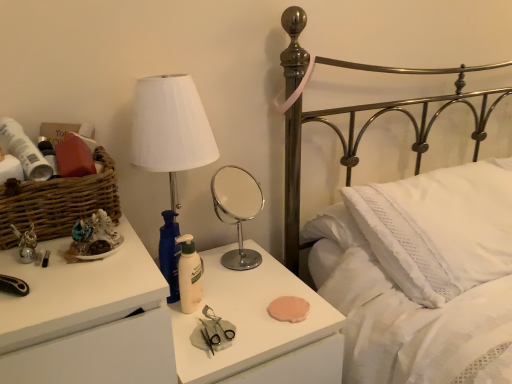
Question: From a real-world perspective, is matte plastic lotion at center, which appears as the first nightstand when viewed from the right, physically below chrome/metallic round mirror at center?

Choices:
 (A) yes
 (B) no

Answer: (A)

Question: Can you confirm if matte plastic lotion at center, which appears as the first nightstand when viewed from the right, is positioned to the left of chrome/metallic round mirror at center?

Choices:
 (A) no
 (B) yes

Answer: (B)

Question: Can you confirm if matte plastic lotion at center, which is the second nightstand in left-to-right order, is bigger than chrome/metallic round mirror at center?

Choices:
 (A) yes
 (B) no

Answer: (A)

Question: Could you tell me if matte plastic lotion at center, which is the second nightstand in left-to-right order, is facing chrome/metallic round mirror at center?

Choices:
 (A) yes
 (B) no

Answer: (B)

Question: Is matte plastic lotion at center, which is the second nightstand in left-to-right order, turned away from chrome/metallic round mirror at center?

Choices:
 (A) yes
 (B) no

Answer: (B)

Question: From a real-world perspective, is chrome/metallic round mirror at center physically located above or below metallic brass bed at upper right?

Choices:
 (A) below
 (B) above

Answer: (B)

Question: Considering the positions of chrome/metallic round mirror at center and metallic brass bed at upper right in the image, is chrome/metallic round mirror at center bigger or smaller than metallic brass bed at upper right?

Choices:
 (A) big
 (B) small

Answer: (B)

Question: From the image's perspective, is chrome/metallic round mirror at center positioned above or below metallic brass bed at upper right?

Choices:
 (A) above
 (B) below

Answer: (B)

Question: Considering the relative positions of chrome/metallic round mirror at center and metallic brass bed at upper right in the image provided, is chrome/metallic round mirror at center to the left or to the right of metallic brass bed at upper right?

Choices:
 (A) right
 (B) left

Answer: (B)

Question: Considering their positions, is white matte lotion at center located in front of or behind white fabric lampshade at upper left?

Choices:
 (A) behind
 (B) front

Answer: (A)

Question: In terms of width, does white matte lotion at center look wider or thinner when compared to white fabric lampshade at upper left?

Choices:
 (A) thin
 (B) wide

Answer: (A)

Question: In terms of size, does white matte lotion at center appear bigger or smaller than white fabric lampshade at upper left?

Choices:
 (A) big
 (B) small

Answer: (B)

Question: Is white matte lotion at center situated inside white fabric lampshade at upper left or outside?

Choices:
 (A) outside
 (B) inside

Answer: (A)

Question: From their relative heights in the image, would you say matte plastic lotion at center, which is the second nightstand in left-to-right order, is taller or shorter than brown woven basket at left?

Choices:
 (A) short
 (B) tall

Answer: (B)

Question: Visually, is matte plastic lotion at center, which appears as the first nightstand when viewed from the right, positioned to the left or to the right of brown woven basket at left?

Choices:
 (A) left
 (B) right

Answer: (B)